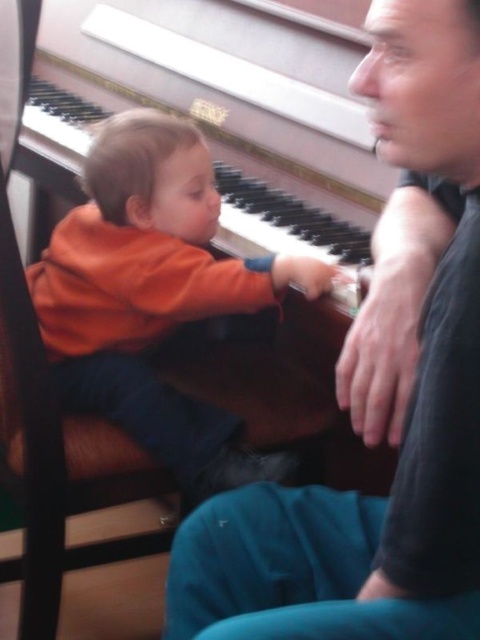
Question: Does matte black shirt at center have a larger size compared to orange soft fabric toddler at center?

Choices:
 (A) no
 (B) yes

Answer: (A)

Question: Is matte black shirt at center smaller than orange soft fabric toddler at center?

Choices:
 (A) no
 (B) yes

Answer: (B)

Question: Which point is closer to the camera taking this photo?

Choices:
 (A) (408, 45)
 (B) (75, 403)

Answer: (A)

Question: Which of the following is the closest to the observer?

Choices:
 (A) (86, 275)
 (B) (300, 561)

Answer: (B)

Question: Is matte black shirt at center bigger than orange soft fabric toddler at center?

Choices:
 (A) no
 (B) yes

Answer: (A)